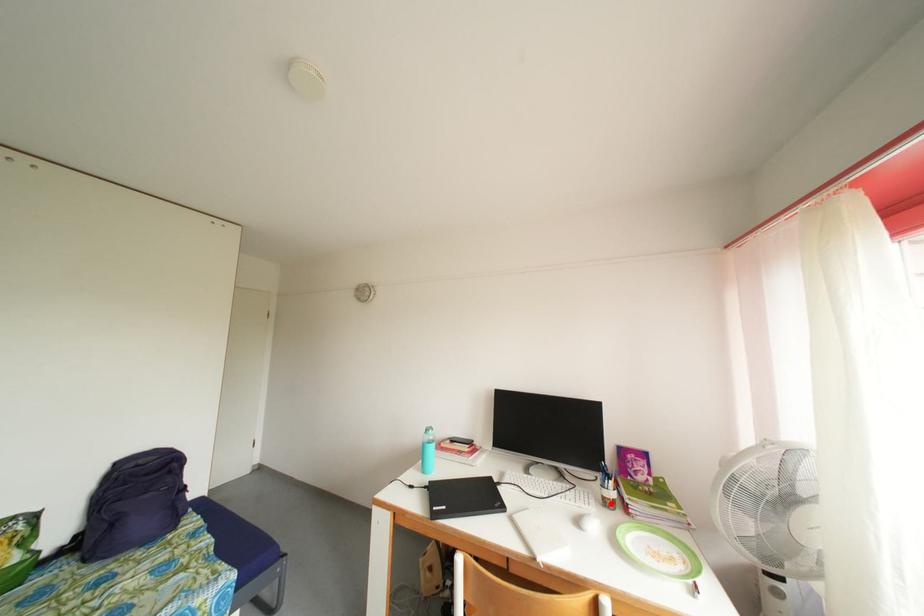
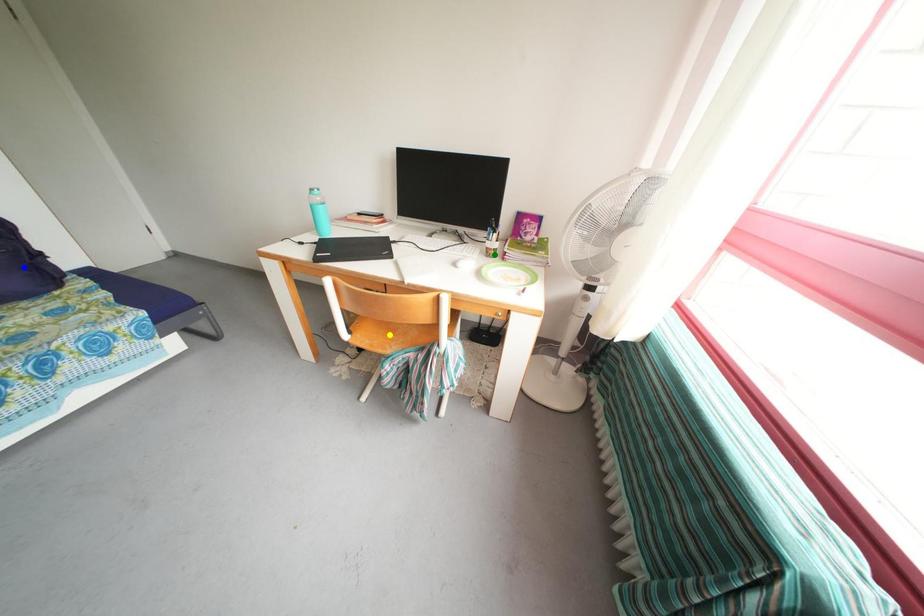
Question: I am providing you with two images of the same scene from different viewpoints. A red point is marked on the first image. You are given multiple points on the second image. Which mark in image 2 goes with the point in image 1?

Choices:
 (A) blue point
 (B) green point
 (C) yellow point

Answer: (B)